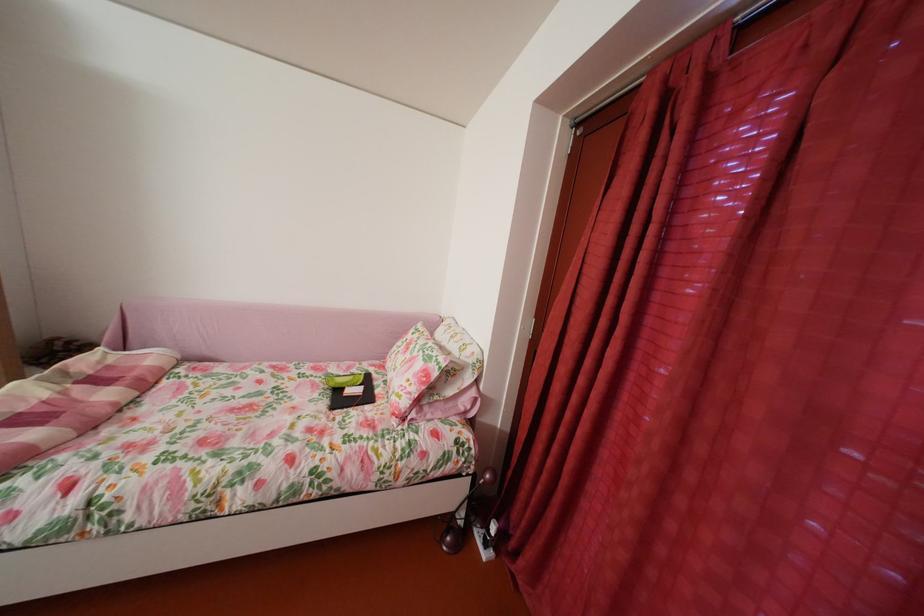
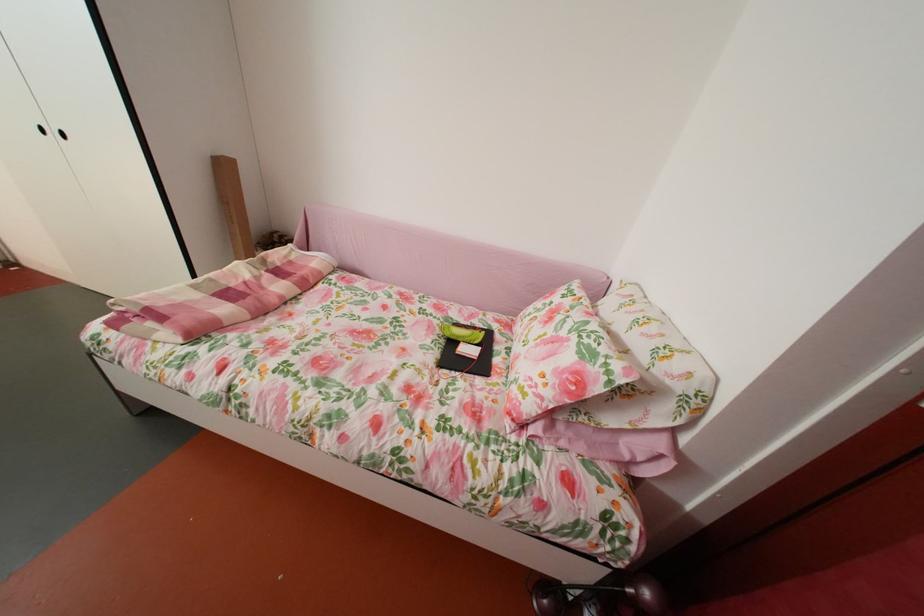
Where in the second image is the point corresponding to point 417,408 from the first image?

(541, 413)